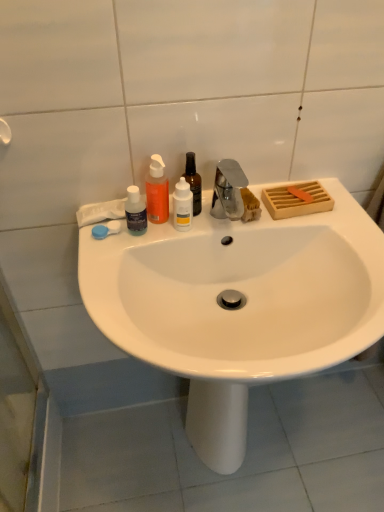
Image resolution: width=384 pixels, height=512 pixels. What are the coordinates of `vacant area that is in front of matte black bottle at left, which is the 1th bottle in left-to-right order` in the screenshot? It's located at (110, 278).